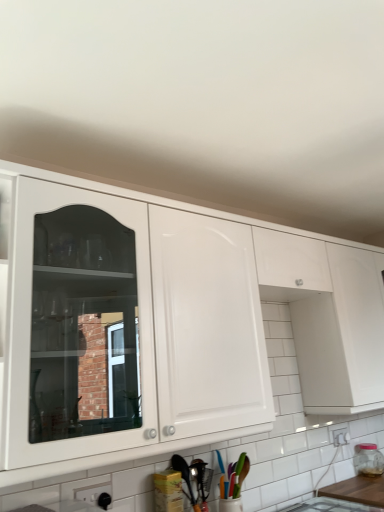
Question: Relative to transparent glass jar at right, is white glossy cabinet at upper center in front or behind?

Choices:
 (A) front
 (B) behind

Answer: (A)

Question: From their relative heights in the image, would you say white glossy cabinet at upper center is taller or shorter than transparent glass jar at right?

Choices:
 (A) short
 (B) tall

Answer: (B)

Question: Which object is positioned farthest from the wooden at lower right?

Choices:
 (A) metallic silver spoon at lower center
 (B) white glossy cabinet at upper center
 (C) transparent glass jar at right

Answer: (B)

Question: Which is nearer to the wooden at lower right?

Choices:
 (A) white glossy cabinet at upper center
 (B) transparent glass jar at right
 (C) metallic silver spoon at lower center

Answer: (B)